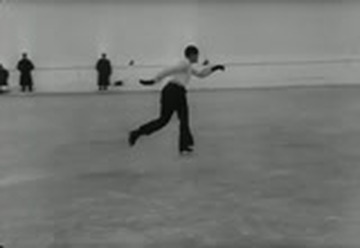
You are a GUI agent. You are given a task and a screenshot of the screen. Output one action in this format:
    pyautogui.click(x=<x>, y=<y>)
    Task: Click on the wall
    This screenshot has height=248, width=360.
    Given the screenshot: What is the action you would take?
    pyautogui.click(x=297, y=40), pyautogui.click(x=64, y=23)